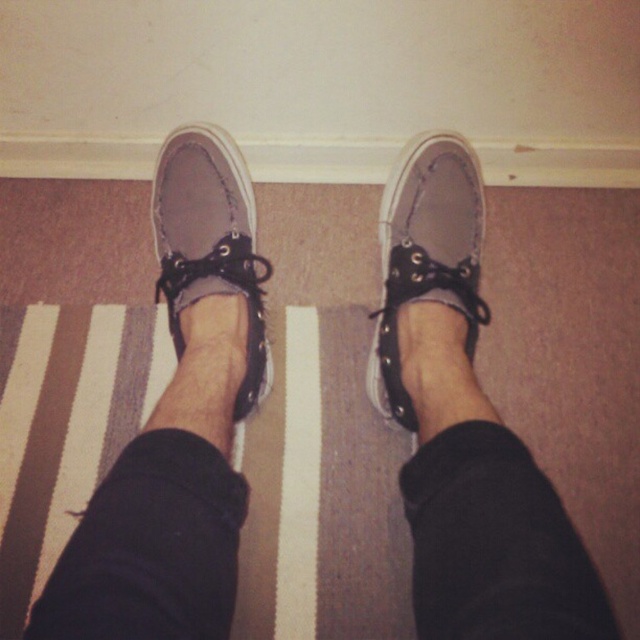
You are trying to reach a small object located at point (472, 234) in the image. Your hand can extend 30 inches forward. Can you reach it?

The distance between you and the point (472, 234) is 32.52 inches, which is beyond the 30 inch reach of your hand. You cannot reach it.

You are trying to decide which pair of shoes to wear today. You notice both the matte gray canvas shoe at center and the gray suede shoe at center are on the floor. Which one is closer to the ground?

The matte gray canvas shoe at center is closer to the ground because it is located below the gray suede shoe at center.

You are a shoe organizer trying to place two shoes in a narrow closet shelf. The shelf is only 25 centimeters wide. Can both the matte gray canvas shoe at center and the gray suede shoe at center fit side by side on the shelf?

The matte gray canvas shoe at center is 22.11 centimeters from the gray suede shoe at center. Since the total required space would be approximately 22.11 centimeters plus the width of both shoes, but the shelf is only 25 centimeters wide, it depends on the individual widths of each shoe. However, the description only provides the distance between them, not their sizes. Without knowing their actual widths, we cannot determine if they fit.